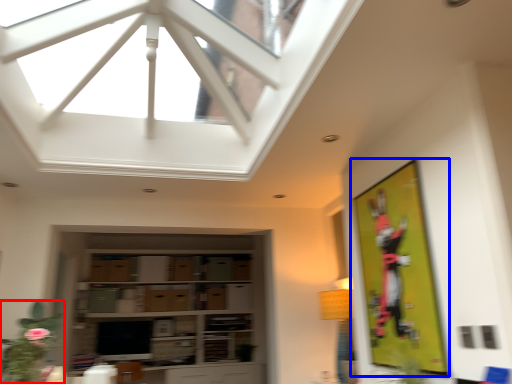
Question: Which object is further to the camera taking this photo, plant (highlighted by a red box) or bulletin board (highlighted by a blue box)?

Choices:
 (A) plant
 (B) bulletin board

Answer: (B)